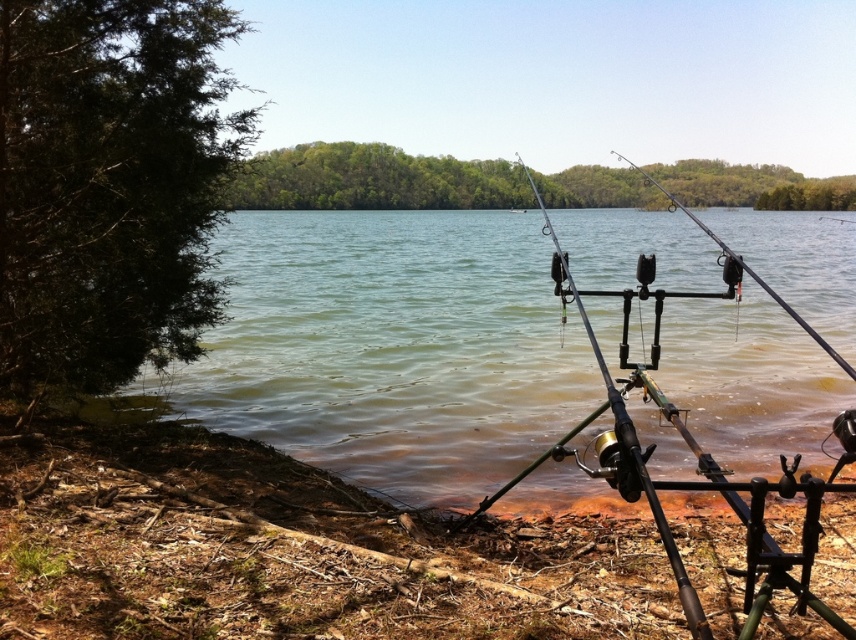
You are a fisherman who wants to cast your black matte fishing pole at center into the greenish water at center. Based on the distance between them, can you successfully cast the fishing pole into the water without moving closer?

The greenish water at center and black matte fishing pole at center are 15.32 feet apart from each other. Assuming a typical casting distance of about 10 feet, you would need to move closer to ensure the pole can reach the water.

You are a hiker who just arrived at the lakeside and want to place your 5 feet long hiking pole between the brown dirt shoreline at lower left and the metallic fishing pole at center. Can you fit it there without bending it?

The distance between the brown dirt shoreline at lower left and the metallic fishing pole at center is 4.70 feet, which is shorter than the 5 feet long hiking pole. Therefore, you cannot fit it there without bending it.

You are standing at the edge of the lake and notice a point marked at coordinates (391, 348). What is located at that point?

The point at coordinates (391, 348) is occupied by greenish water at center.